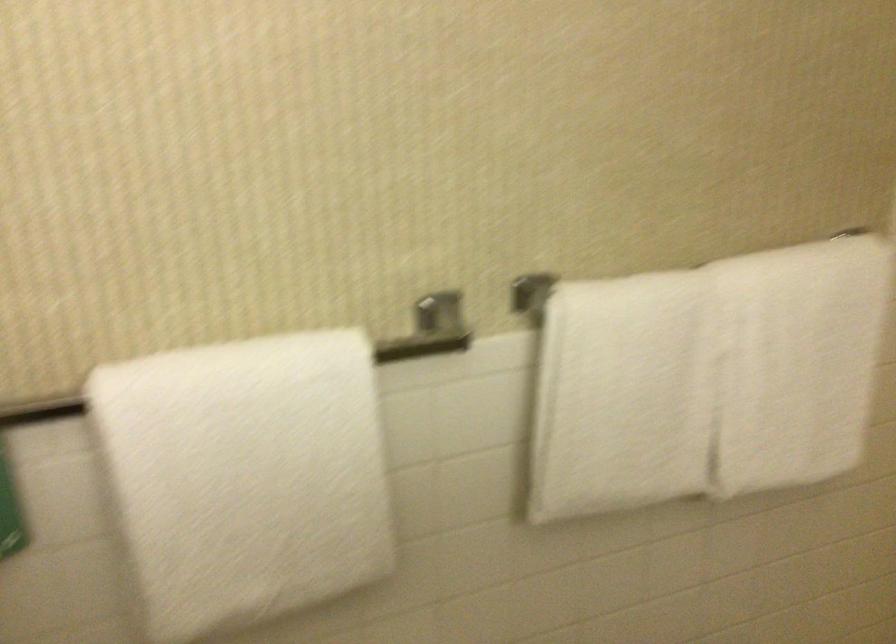
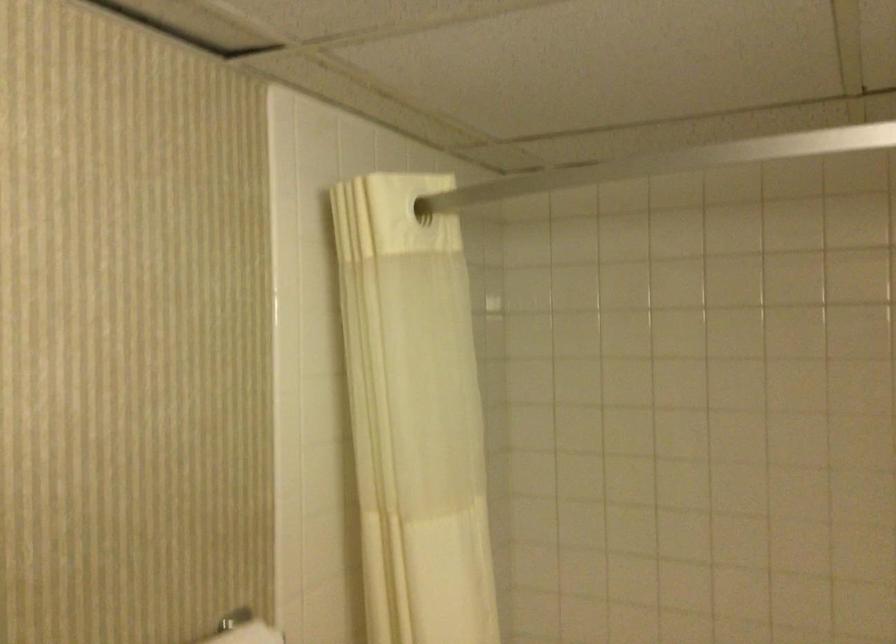
The images are taken continuously from a first-person perspective. In which direction is your viewpoint rotating?

The camera's rotation is toward right-up.